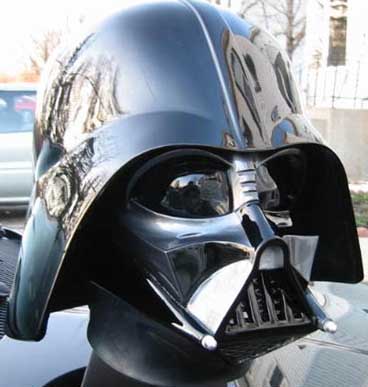
Find the location of a particular element. screws is located at coordinates (212, 345), (330, 330).